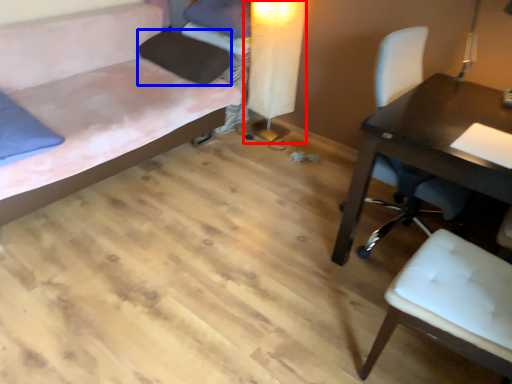
Question: Which object is closer to the camera taking this photo, table lamp (highlighted by a red box) or pillow (highlighted by a blue box)?

Choices:
 (A) table lamp
 (B) pillow

Answer: (A)